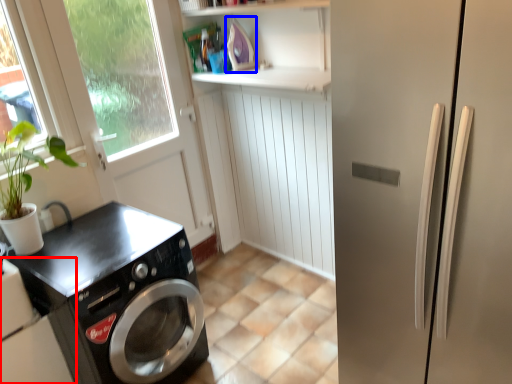
Question: Which object appears farthest to the camera in this image, home appliance (highlighted by a red box) or appliance (highlighted by a blue box)?

Choices:
 (A) home appliance
 (B) appliance

Answer: (B)